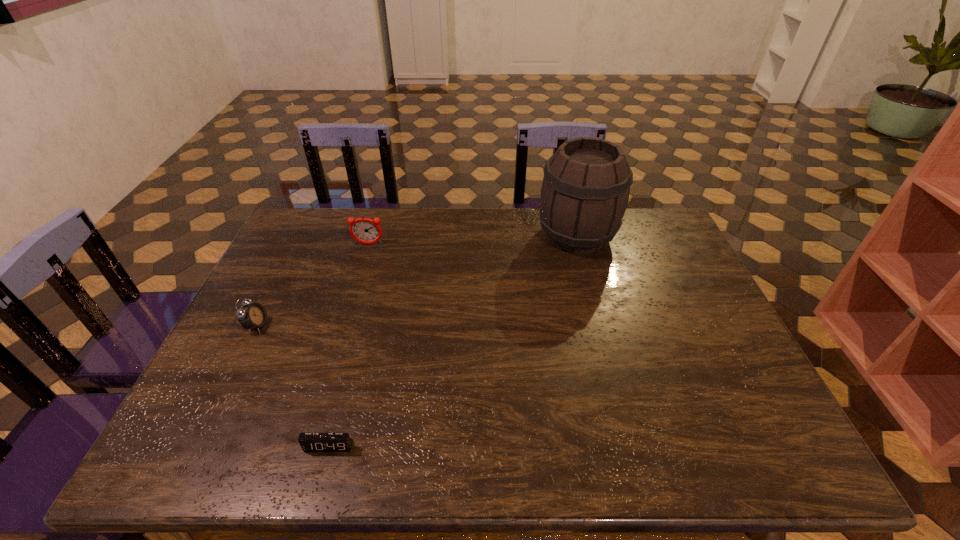
In the image, there is a desktop. Identify the location of vacant space at the far right corner. (651, 230).

Locate an element on the screen. Image resolution: width=960 pixels, height=540 pixels. vacant space that is in between the nearest alarm clock and the second tallest alarm clock is located at coordinates (293, 386).

I want to click on unoccupied position between the farthest alarm clock and the wine bucket, so click(472, 240).

Find the location of a particular element. Image resolution: width=960 pixels, height=540 pixels. free space between the shortest object and the tallest alarm clock is located at coordinates (348, 346).

I want to click on free point between the farthest alarm clock and the rightmost object, so click(472, 240).

I want to click on free space between the second farthest alarm clock and the third shortest object, so click(313, 285).

Find the location of a particular element. Image resolution: width=960 pixels, height=540 pixels. vacant space that is in between the second farthest alarm clock and the shortest object is located at coordinates (293, 386).

Image resolution: width=960 pixels, height=540 pixels. Identify the location of vacant area between the shortest alarm clock and the rightmost object. (452, 341).

Where is `free spot between the shortest alarm clock and the second shortest alarm clock`? The width and height of the screenshot is (960, 540). free spot between the shortest alarm clock and the second shortest alarm clock is located at coordinates (293, 386).

Image resolution: width=960 pixels, height=540 pixels. In order to click on free space between the tallest alarm clock and the tallest object in this screenshot , I will do `click(472, 240)`.